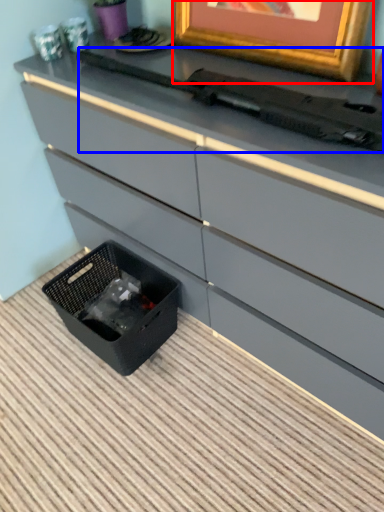
Question: Which object appears closest to the camera in this image, picture frame (highlighted by a red box) or typewriter (highlighted by a blue box)?

Choices:
 (A) picture frame
 (B) typewriter

Answer: (B)